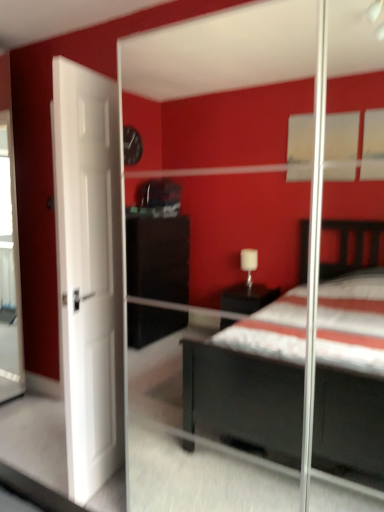
This screenshot has height=512, width=384. Describe the element at coordinates (89, 272) in the screenshot. I see `white matte door at left` at that location.

Locate an element on the screen. white matte door at left is located at coordinates (89, 272).

Locate an element on the screen. The image size is (384, 512). white matte door at left is located at coordinates (89, 272).